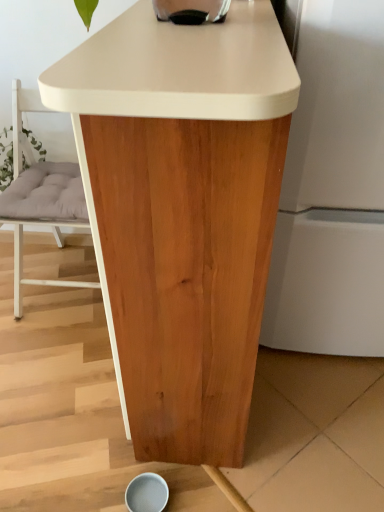
Question: From the image's perspective, is light gray cushioned chair at center above or below natural wood table at center?

Choices:
 (A) below
 (B) above

Answer: (B)

Question: Is light gray cushioned chair at center wider or thinner than natural wood table at center?

Choices:
 (A) wide
 (B) thin

Answer: (A)

Question: In terms of size, does light gray cushioned chair at center appear bigger or smaller than natural wood table at center?

Choices:
 (A) big
 (B) small

Answer: (B)

Question: From a real-world perspective, relative to light gray cushioned chair at center, is natural wood table at center vertically above or below?

Choices:
 (A) below
 (B) above

Answer: (B)

Question: From the image's perspective, is natural wood table at center located above or below light gray cushioned chair at center?

Choices:
 (A) above
 (B) below

Answer: (B)

Question: Would you say natural wood table at center is inside or outside light gray cushioned chair at center?

Choices:
 (A) inside
 (B) outside

Answer: (B)

Question: Considering the positions of natural wood table at center and light gray cushioned chair at center in the image, is natural wood table at center wider or thinner than light gray cushioned chair at center?

Choices:
 (A) wide
 (B) thin

Answer: (B)